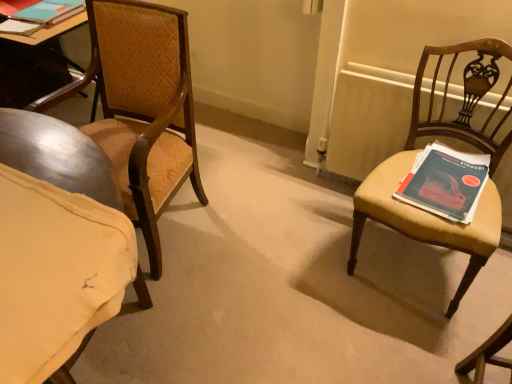
Identify the location of vacant space in front of matte brown chair at right, arranged as the 2th chair when viewed from the left. (400, 339).